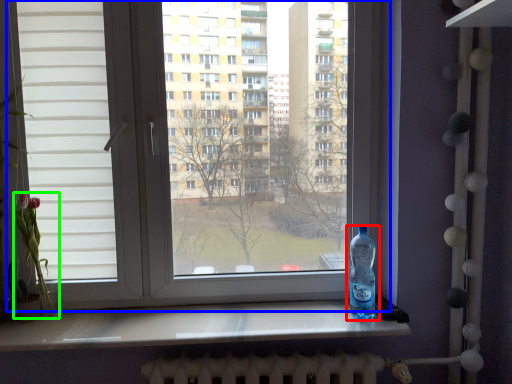
Question: Which is nearer to the bottle (highlighted by a red box)? window (highlighted by a blue box) or flower (highlighted by a green box).

Choices:
 (A) window
 (B) flower

Answer: (A)